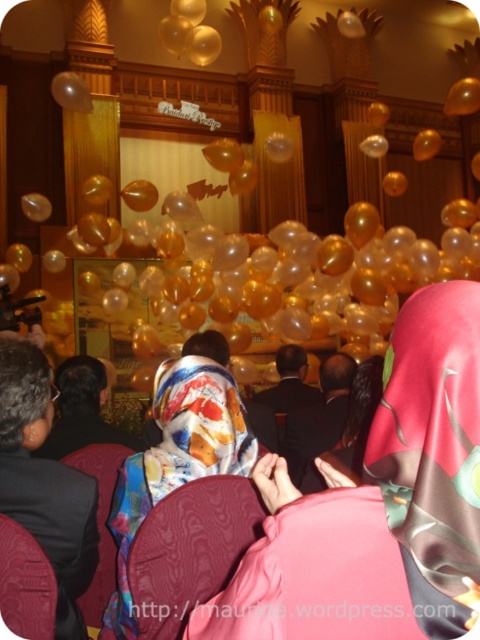
You are a photographer aiming to capture both the silky floral hijab at center and the translucent gold balloon at upper center in a single frame. Based on their positions, which object should you focus on first to ensure both are in focus?

The silky floral hijab at center is lower in height than the translucent gold balloon at upper center, so focusing on the hijab first would allow the balloon to remain in focus due to its higher position.